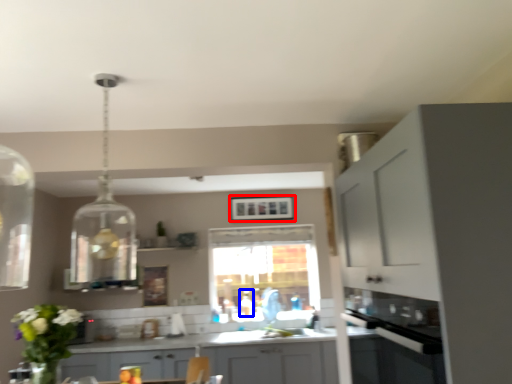
Question: Which object is further to the camera taking this photo, picture frame (highlighted by a red box) or bottle (highlighted by a blue box)?

Choices:
 (A) picture frame
 (B) bottle

Answer: (A)